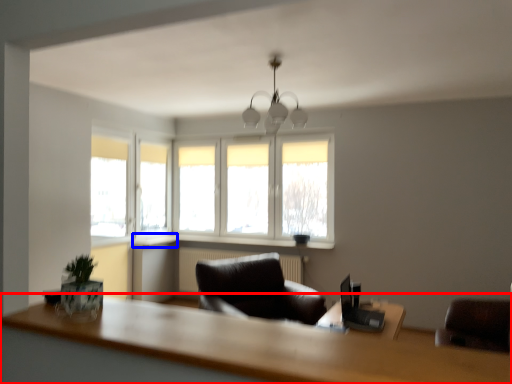
Question: Which object appears closest to the camera in this image, table (highlighted by a red box) or window sill (highlighted by a blue box)?

Choices:
 (A) table
 (B) window sill

Answer: (A)